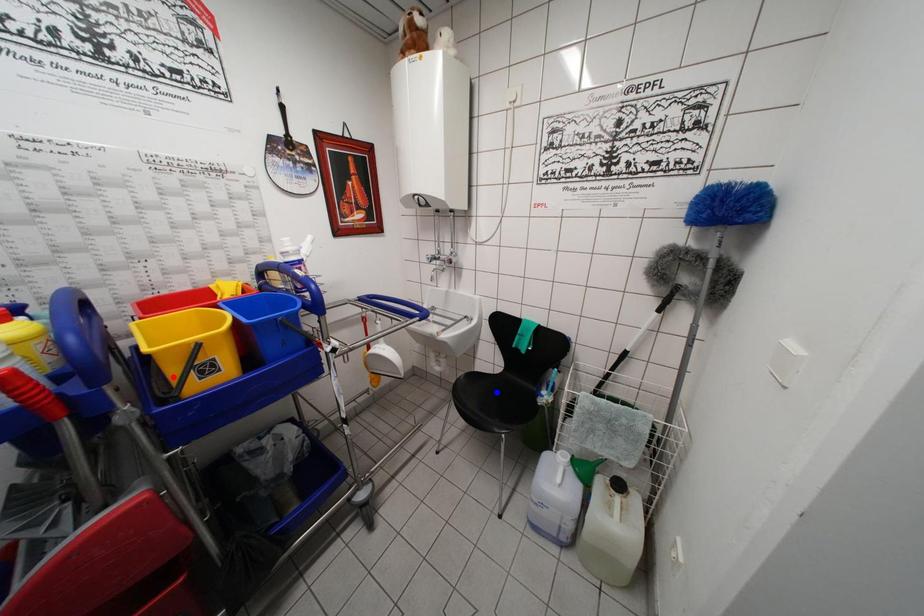
Question: Which of the two points in the image is closer to the camera?

Choices:
 (A) Blue point is closer.
 (B) Red point is closer.

Answer: (B)